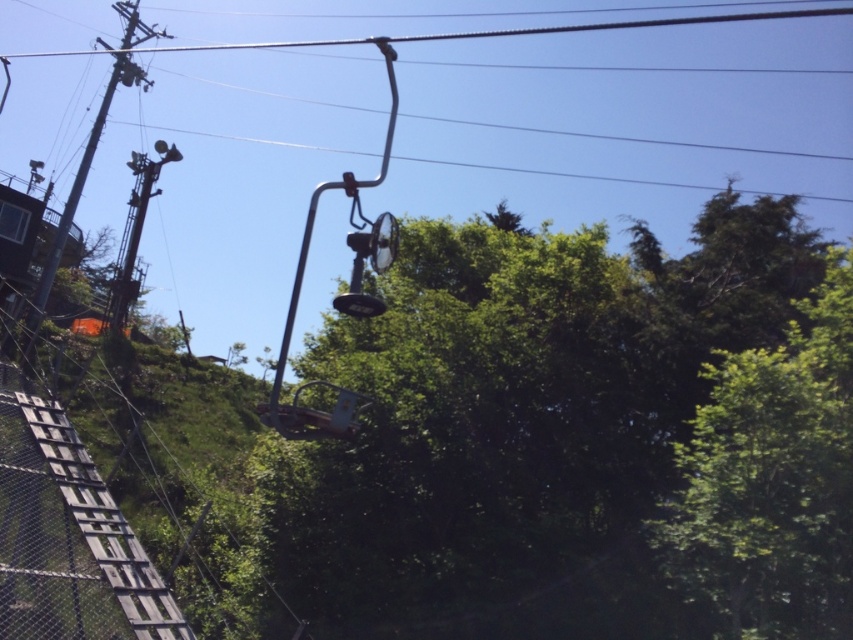
Question: Which of the following is the closest to the observer?

Choices:
 (A) (413, 314)
 (B) (645, 20)

Answer: (A)

Question: Among these objects, which one is farthest from the camera?

Choices:
 (A) metallic wire at upper center
 (B) green leafy tree at upper right
 (C) green leafy tree at center

Answer: (A)

Question: Which object is closer to the camera taking this photo?

Choices:
 (A) green leafy tree at center
 (B) green leafy tree at upper right

Answer: (B)

Question: Can you confirm if green leafy tree at center is positioned to the right of green leafy tree at upper right?

Choices:
 (A) yes
 (B) no

Answer: (B)

Question: Is green leafy tree at center to the right of metallic wire at upper center from the viewer's perspective?

Choices:
 (A) yes
 (B) no

Answer: (A)

Question: Does green leafy tree at center have a lesser width compared to green leafy tree at upper right?

Choices:
 (A) yes
 (B) no

Answer: (B)